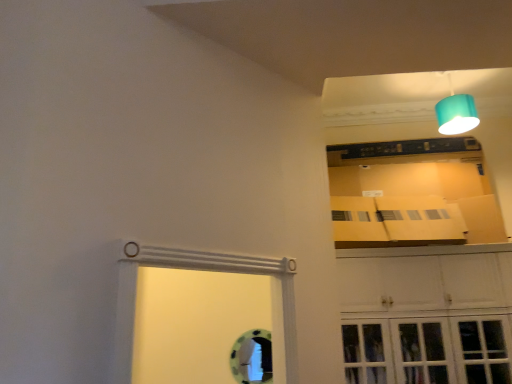
Question: From the image's perspective, relative to white glossy cabinet at upper right, is teal fabric lampshade at upper right above or below?

Choices:
 (A) above
 (B) below

Answer: (A)

Question: Considering the positions of teal fabric lampshade at upper right and white glossy cabinet at upper right in the image, is teal fabric lampshade at upper right wider or thinner than white glossy cabinet at upper right?

Choices:
 (A) wide
 (B) thin

Answer: (B)

Question: In terms of height, does teal fabric lampshade at upper right look taller or shorter compared to white glossy cabinet at upper right?

Choices:
 (A) short
 (B) tall

Answer: (A)

Question: Does point (417, 334) appear closer or farther from the camera than point (452, 130)?

Choices:
 (A) farther
 (B) closer

Answer: (B)

Question: Which is correct: white glossy cabinet at upper right is inside teal fabric lampshade at upper right, or outside of it?

Choices:
 (A) inside
 (B) outside

Answer: (B)

Question: From the image's perspective, is white glossy cabinet at upper right above or below teal fabric lampshade at upper right?

Choices:
 (A) below
 (B) above

Answer: (A)

Question: Is white glossy cabinet at upper right wider or thinner than teal fabric lampshade at upper right?

Choices:
 (A) thin
 (B) wide

Answer: (B)